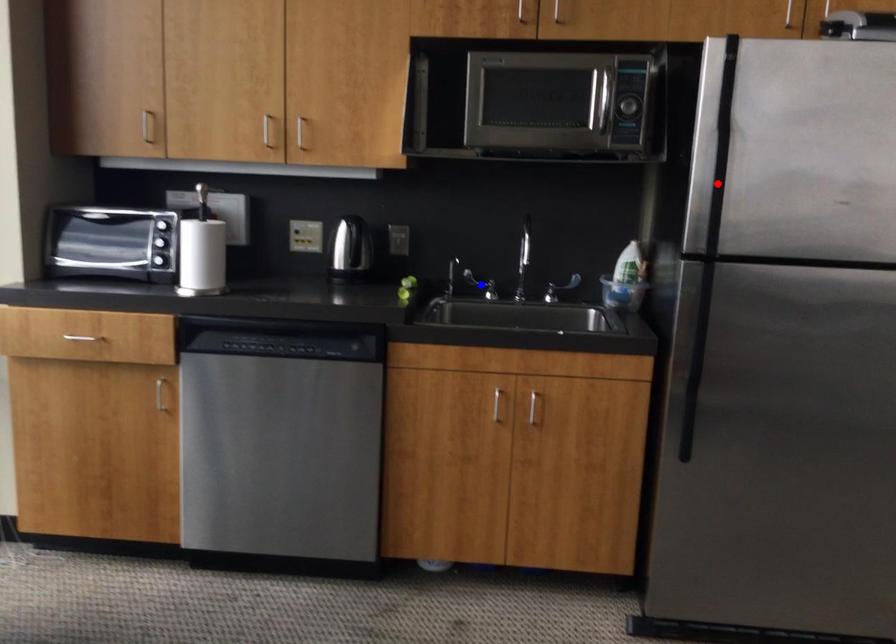
Question: In the image, two points are highlighted. Which point is nearer to the camera? Reply with the corresponding letter.

Choices:
 (A) blue point
 (B) red point

Answer: (B)